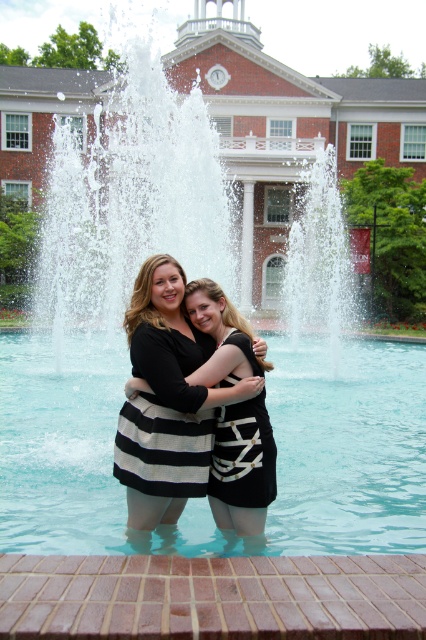
Can you confirm if clear blue water at center is positioned to the left of black striped dress at center?

Correct, you'll find clear blue water at center to the left of black striped dress at center.

Who is higher up, clear blue water at center or black striped dress at center?

black striped dress at center is above.

Where is `clear blue water at center`? The height and width of the screenshot is (640, 426). clear blue water at center is located at coordinates coord(347,448).

Find the location of `clear blue water at center`. clear blue water at center is located at coordinates (347, 448).

Describe the element at coordinates (166, 401) in the screenshot. Image resolution: width=426 pixels, height=640 pixels. I see `black striped dress at center` at that location.

Which is more to the left, black striped dress at center or black matte dress at center?

Positioned to the left is black matte dress at center.

Between point (207, 472) and point (157, 314), which one is positioned in front?

Point (207, 472) is more forward.

This screenshot has height=640, width=426. In order to click on black striped dress at center in this screenshot , I will do `click(166, 401)`.

Can you confirm if clear blue water at center is smaller than black matte dress at center?

No.

Is clear blue water at center positioned in front of black matte dress at center?

Yes, it is in front of black matte dress at center.

Between point (8, 524) and point (160, 256), which one is positioned behind?

Positioned behind is point (160, 256).

The height and width of the screenshot is (640, 426). Find the location of `clear blue water at center`. clear blue water at center is located at coordinates (347, 448).